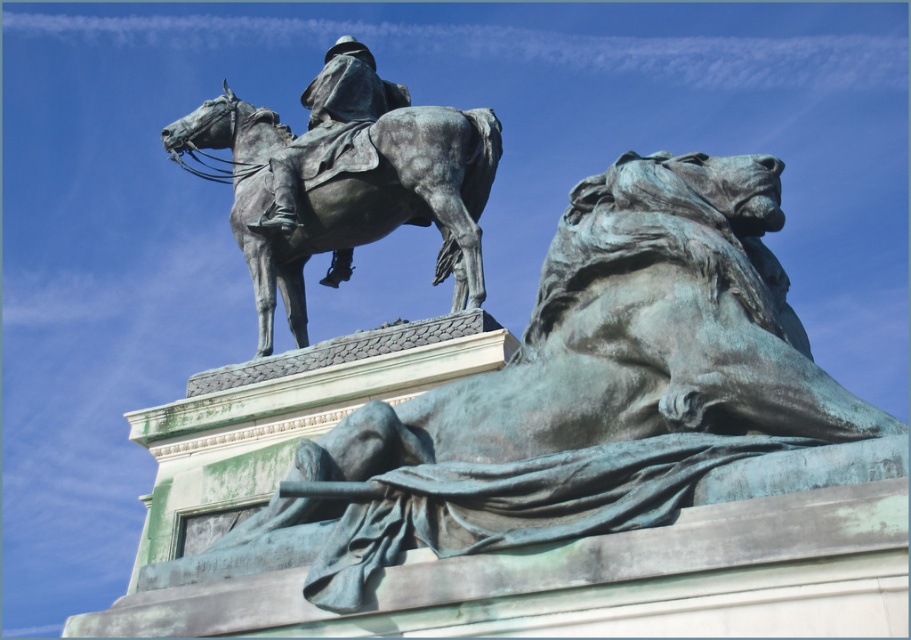
Is bronze/green patina horse at upper center positioned in front of bronze statue at center?

Yes, bronze/green patina horse at upper center is closer to the viewer.

The image size is (911, 640). I want to click on bronze/green patina horse at upper center, so click(x=351, y=195).

In order to click on bronze/green patina horse at upper center in this screenshot , I will do (x=351, y=195).